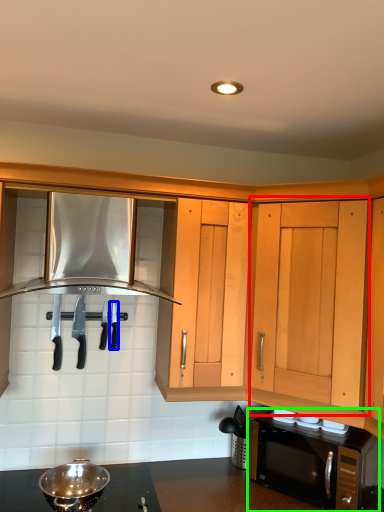
Question: Which object is positioned closest to cabinetry (highlighted by a red box)? Select from silverware (highlighted by a blue box) and microwave oven (highlighted by a green box).

Choices:
 (A) silverware
 (B) microwave oven

Answer: (B)